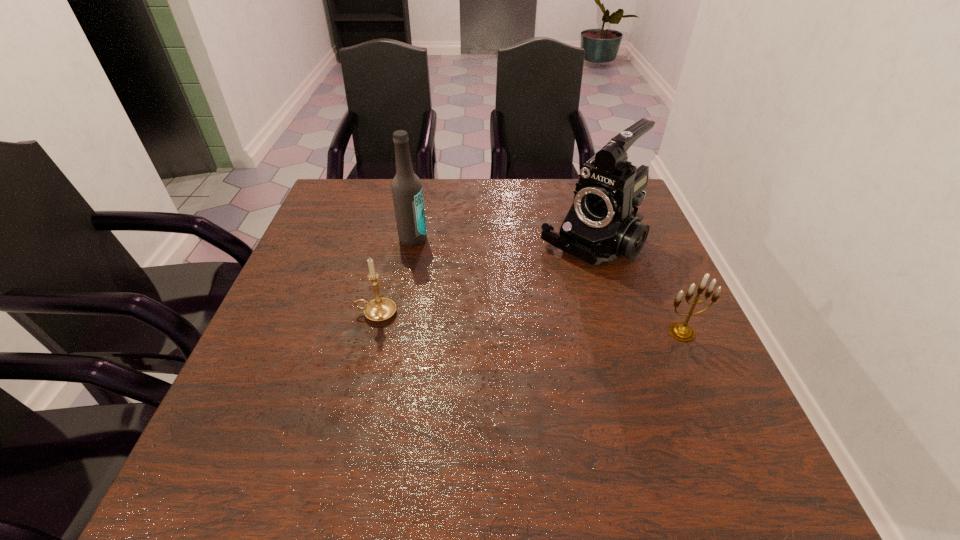
The height and width of the screenshot is (540, 960). I want to click on vacant space located on the lens mount of the camcorder, so click(524, 296).

Find the location of a particular element. Image resolution: width=960 pixels, height=540 pixels. vacant space located on the label of the beer bottle is located at coordinates (513, 330).

Find the location of a particular element. The image size is (960, 540). free space located on the label of the beer bottle is located at coordinates (431, 255).

This screenshot has width=960, height=540. In order to click on free space located 0.120m on the label of the beer bottle in this screenshot , I will do `click(446, 269)`.

This screenshot has height=540, width=960. I want to click on object that is at the far edge, so click(600, 226).

What are the coordinates of `candelabrum that is at the right edge` in the screenshot? It's located at (683, 332).

Where is `camcorder at the right edge`? This screenshot has width=960, height=540. camcorder at the right edge is located at coordinates (600, 226).

Identify the location of object located at the far right corner. This screenshot has width=960, height=540. (600, 226).

Find the location of a particular element. This screenshot has height=540, width=960. free space at the far edge of the desktop is located at coordinates (494, 191).

In the image, there is a desktop. Where is `vacant space at the near edge`? Image resolution: width=960 pixels, height=540 pixels. vacant space at the near edge is located at coordinates (569, 425).